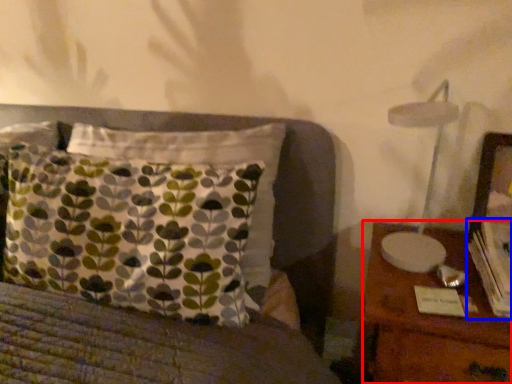
Question: Which object appears farthest to the camera in this image, nightstand (highlighted by a red box) or book (highlighted by a blue box)?

Choices:
 (A) nightstand
 (B) book

Answer: (B)